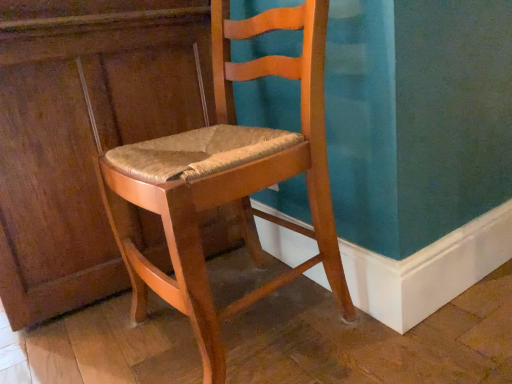
What are the coordinates of `matte wood chair at center` in the screenshot? It's located at (228, 180).

Describe the element at coordinates (228, 180) in the screenshot. The width and height of the screenshot is (512, 384). I see `matte wood chair at center` at that location.

The width and height of the screenshot is (512, 384). Describe the element at coordinates (84, 133) in the screenshot. I see `matte wood dresser at left` at that location.

What are the coordinates of `matte wood dresser at left` in the screenshot? It's located at (84, 133).

Locate an element on the screen. matte wood chair at center is located at coordinates (228, 180).

Based on the photo, is matte wood dresser at left at the left side of matte wood chair at center?

Indeed, matte wood dresser at left is positioned on the left side of matte wood chair at center.

Is the position of matte wood dresser at left less distant than that of matte wood chair at center?

No, the depth of matte wood dresser at left is greater than that of matte wood chair at center.

Does point (141, 109) come in front of point (308, 42)?

That is False.

From the image's perspective, does matte wood dresser at left appear lower than matte wood chair at center?

Actually, matte wood dresser at left appears above matte wood chair at center in the image.

From a real-world perspective, is matte wood dresser at left positioned over matte wood chair at center based on gravity?

Indeed, from a real-world perspective, matte wood dresser at left stands above matte wood chair at center.

Looking at this image, in terms of width, does matte wood dresser at left look wider or thinner when compared to matte wood chair at center?

Clearly, matte wood dresser at left has more width compared to matte wood chair at center.

Which of these two, matte wood dresser at left or matte wood chair at center, stands taller?

With more height is matte wood dresser at left.

Is matte wood dresser at left bigger than matte wood chair at center?

Yes, matte wood dresser at left is bigger than matte wood chair at center.

Could matte wood chair at center be considered to be inside matte wood dresser at left?

No, matte wood dresser at left does not contain matte wood chair at center.

Would you say matte wood dresser at left is a long distance from matte wood chair at center?

No, matte wood dresser at left is not far away from matte wood chair at center.

Could you tell me if matte wood dresser at left is turned towards matte wood chair at center?

No, matte wood dresser at left does not turn towards matte wood chair at center.

How different are the orientations of matte wood dresser at left and matte wood chair at center in degrees?

1.06 degrees.

Identify the location of chair located below the matte wood dresser at left (from the image's perspective). The height and width of the screenshot is (384, 512). (228, 180).

Considering the relative positions of matte wood chair at center and matte wood dresser at left in the image provided, is matte wood chair at center to the right of matte wood dresser at left from the viewer's perspective?

Yes, matte wood chair at center is to the right of matte wood dresser at left.

Considering the relative positions of matte wood chair at center and matte wood dresser at left in the image provided, is matte wood chair at center in front of matte wood dresser at left?

Yes.

Is point (191, 168) closer to camera compared to point (45, 5)?

Yes.

Looking at this image, from the image's perspective, who appears lower, matte wood chair at center or matte wood dresser at left?

From the image's view, matte wood chair at center is below.

From a real-world perspective, is matte wood chair at center located higher than matte wood dresser at left?

Incorrect, from a real-world perspective, matte wood chair at center is lower than matte wood dresser at left.

Does matte wood chair at center have a greater width compared to matte wood dresser at left?

No.

In terms of height, does matte wood chair at center look taller or shorter compared to matte wood dresser at left?

Considering their sizes, matte wood chair at center has less height than matte wood dresser at left.

Between matte wood chair at center and matte wood dresser at left, which one has smaller size?

With smaller size is matte wood chair at center.

Is matte wood chair at center positioned beyond the bounds of matte wood dresser at left?

Absolutely, matte wood chair at center is external to matte wood dresser at left.

Are matte wood chair at center and matte wood dresser at left making contact?

No, matte wood chair at center is not making contact with matte wood dresser at left.

Based on the photo, could you tell me if matte wood chair at center is turned towards matte wood dresser at left?

No, matte wood chair at center does not turn towards matte wood dresser at left.

I want to click on chair that appears on the right of matte wood dresser at left, so click(x=228, y=180).

Identify the location of dresser positioned vertically above the matte wood chair at center (from a real-world perspective). (84, 133).

Find the location of `chair located underneath the matte wood dresser at left (from a real-world perspective)`. chair located underneath the matte wood dresser at left (from a real-world perspective) is located at coordinates (228, 180).